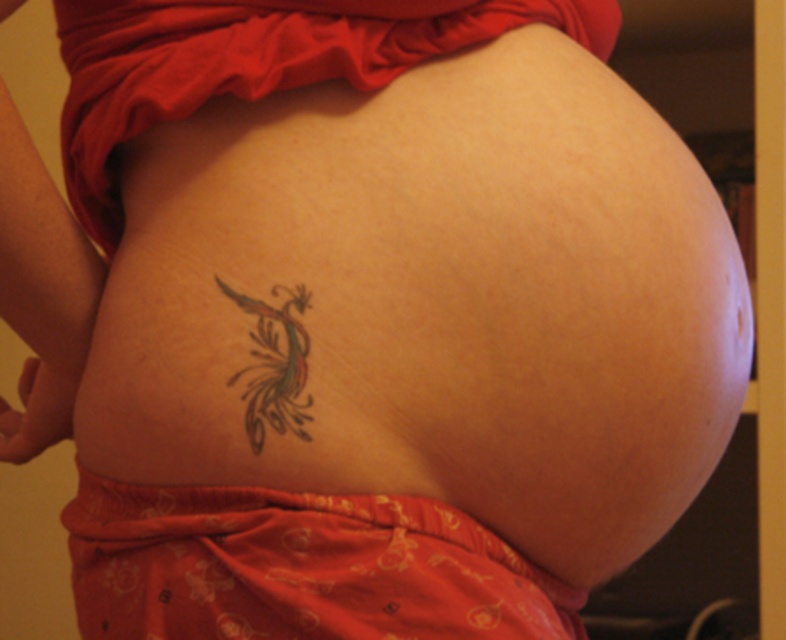
Between point (153, 557) and point (303, 417), which one is positioned in front?

Positioned in front is point (303, 417).

In the scene shown: Who is more forward, (x=329, y=609) or (x=285, y=304)?

Positioned in front is point (x=329, y=609).

This screenshot has width=786, height=640. I want to click on matte orange fabric at lower center, so click(x=298, y=568).